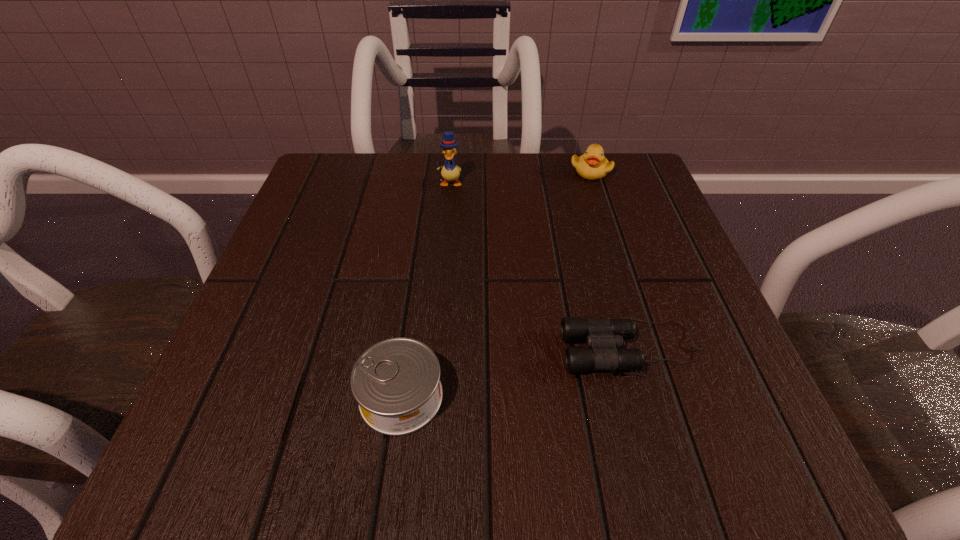
What are the coordinates of `the tallest object` in the screenshot? It's located at (450, 171).

Identify the location of the left duckling. (450, 171).

You are a GUI agent. You are given a task and a screenshot of the screen. Output one action in this format:
    pyautogui.click(x=<x>, y=<y>)
    Task: Click on the shorter duckling
    This screenshot has height=540, width=960.
    Given the screenshot: What is the action you would take?
    pyautogui.click(x=592, y=165)

Find the location of a particular element. This screenshot has height=540, width=960. can is located at coordinates (396, 382).

Locate an element on the screen. This screenshot has width=960, height=540. the shortest object is located at coordinates (603, 335).

Where is `vacant space situated on the face of the taller duckling, where the monocle is placed`? This screenshot has width=960, height=540. vacant space situated on the face of the taller duckling, where the monocle is placed is located at coordinates (446, 228).

Find the location of a particular element. vacant space located 0.210m at the face of the right duckling is located at coordinates (614, 246).

This screenshot has width=960, height=540. I want to click on vacant space located on the back of the can, so click(x=418, y=272).

Find the location of a particular element. This screenshot has height=540, width=960. blank space located at the eyepiece of the binoculars is located at coordinates (293, 348).

Where is `free spot located at the eyepiece of the binoculars`? free spot located at the eyepiece of the binoculars is located at coordinates (401, 348).